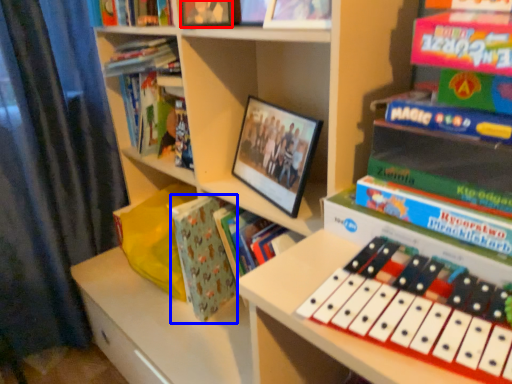
Question: Among these objects, which one is farthest to the camera, book (highlighted by a red box) or paperback book (highlighted by a blue box)?

Choices:
 (A) book
 (B) paperback book

Answer: (B)